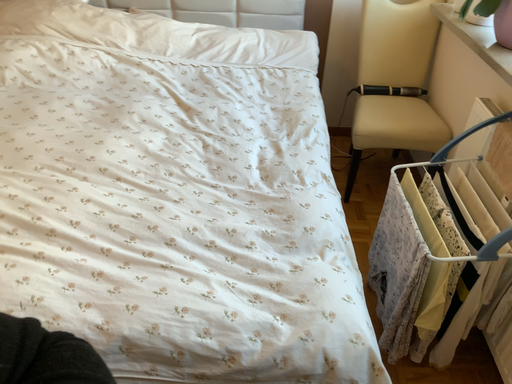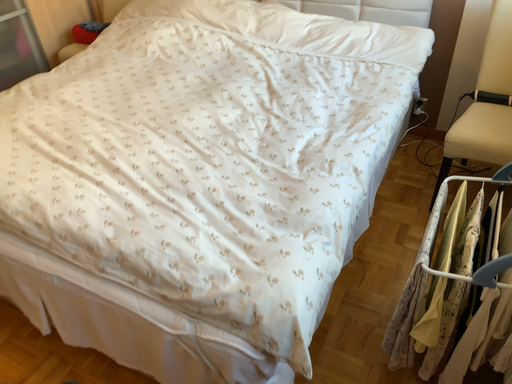
Question: How did the camera likely rotate when shooting the video?

Choices:
 (A) rotated right
 (B) rotated left

Answer: (B)